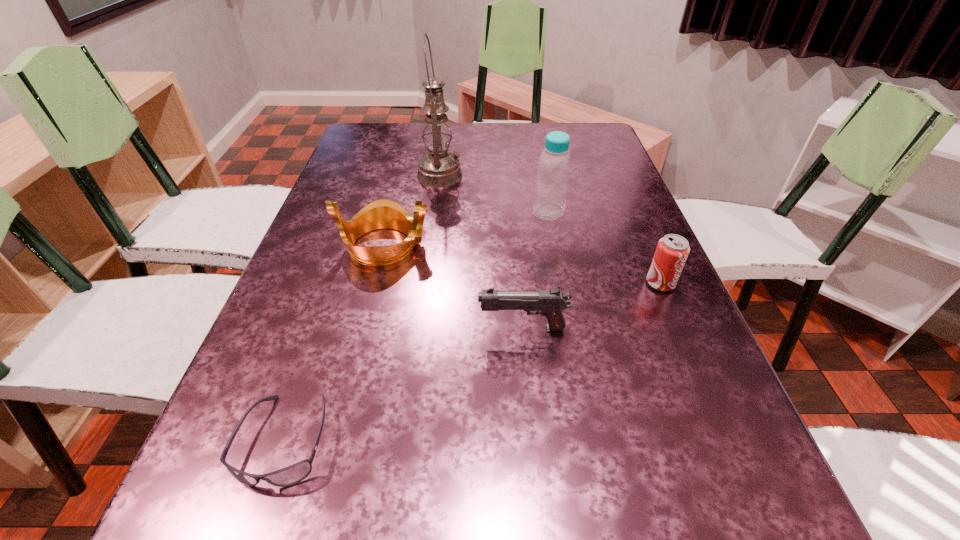
Identify the location of free region located on the front of the bottle. This screenshot has height=540, width=960. (573, 335).

You are a GUI agent. You are given a task and a screenshot of the screen. Output one action in this format:
    pyautogui.click(x=<x>, y=<y>)
    Task: Click on the vacant space positioned 0.130m at the front emblem of the tiara
    
    Given the screenshot: What is the action you would take?
    pyautogui.click(x=487, y=245)

The image size is (960, 540). Identify the location of free location located on the back of the third nearest object. (639, 234).

Locate an element on the screen. This screenshot has width=960, height=540. vacant area situated in the direction the gun is aimed is located at coordinates (338, 328).

The height and width of the screenshot is (540, 960). Find the location of `vacant area situated in the direction the gun is aimed`. vacant area situated in the direction the gun is aimed is located at coordinates (307, 328).

Find the location of a particular element. The width and height of the screenshot is (960, 540). vacant space situated 0.190m in the direction the gun is aimed is located at coordinates (380, 328).

Image resolution: width=960 pixels, height=540 pixels. Find the location of `vacant area situated 0.050m on the lenses of the sunglasses`. vacant area situated 0.050m on the lenses of the sunglasses is located at coordinates (254, 529).

Find the location of a particular element. This screenshot has width=960, height=540. tiara located in the left edge section of the desktop is located at coordinates (383, 213).

Find the location of a particular element. This screenshot has height=540, width=960. sunglasses at the left edge is located at coordinates (293, 474).

Where is `object that is at the right edge`? This screenshot has width=960, height=540. object that is at the right edge is located at coordinates (672, 250).